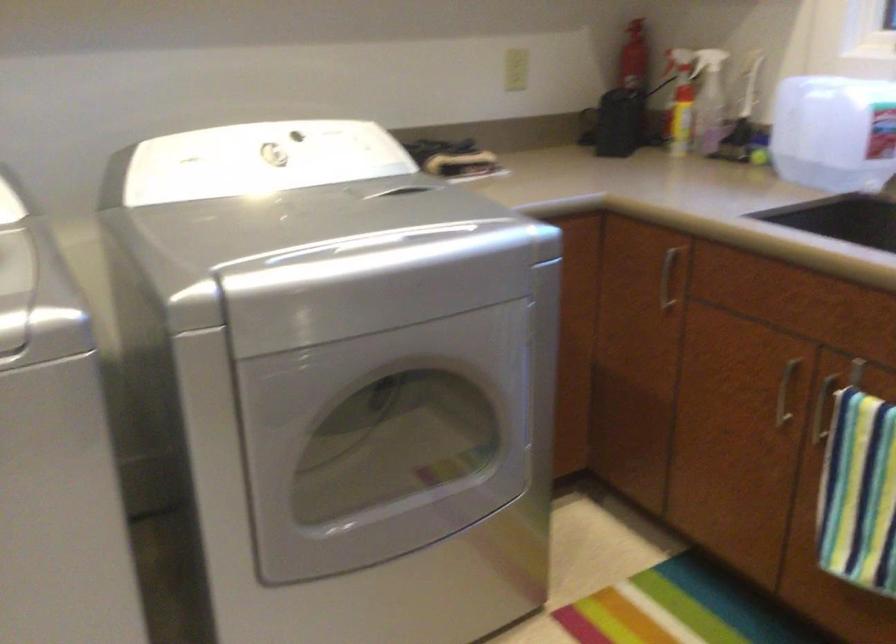
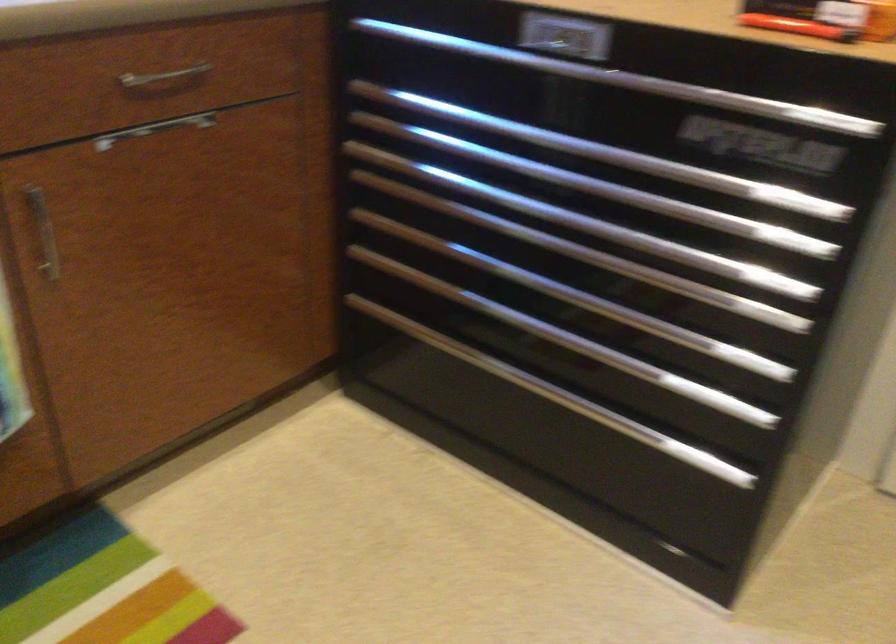
The first image is from the beginning of the video and the second image is from the end. How did the camera likely rotate when shooting the video?

The rotation direction of the camera is right-down.